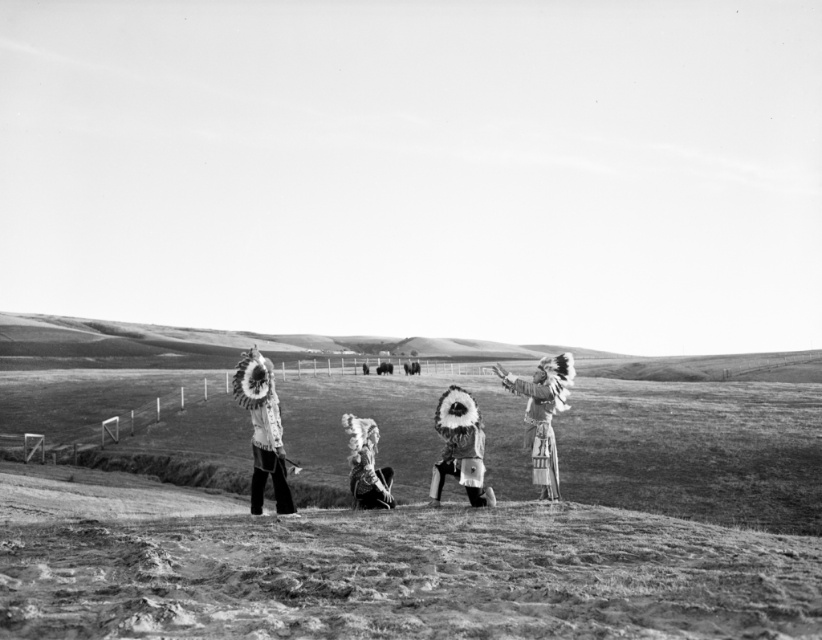
Question: Can you confirm if grassy hillside at center is wider than white feather headdress at center?

Choices:
 (A) yes
 (B) no

Answer: (A)

Question: Is grassy hillside at center positioned in front of feathered headdress at right?

Choices:
 (A) yes
 (B) no

Answer: (B)

Question: Considering the real-world distances, which object is farthest from the grassy hillside at center?

Choices:
 (A) feathered headdress at right
 (B) fuzzy fur headdress at center

Answer: (B)

Question: Which point is farther from the camera taking this photo?

Choices:
 (A) (368, 445)
 (B) (282, 451)

Answer: (A)

Question: Among these objects, which one is nearest to the camera?

Choices:
 (A) fuzzy fur headdress at center
 (B) grassy hillside at center
 (C) feathered headdress at right
 (D) white feather headdress at center

Answer: (D)

Question: Does grassy hillside at center have a smaller size compared to fuzzy fur headdress at center?

Choices:
 (A) yes
 (B) no

Answer: (B)